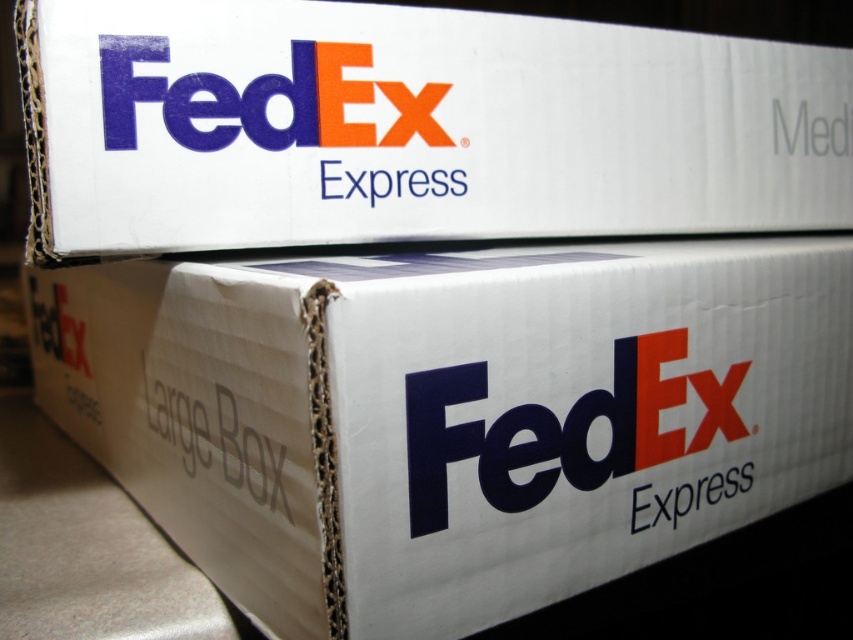
Is point (207, 460) more distant than point (473, 451)?

That is True.

Who is shorter, white cardboard box at center or matte cardboard fedex express logo at center?

matte cardboard fedex express logo at center

Identify the location of white cardboard box at center. (448, 413).

Between point (241, 122) and point (704, 504), which one is positioned behind?

The point (704, 504) is behind.

The width and height of the screenshot is (853, 640). I want to click on white cardboard box at upper center, so click(x=410, y=125).

Looking at this image, who is taller, white cardboard box at center or matte cardboard fedex logo at upper center?

white cardboard box at center is taller.

The image size is (853, 640). What are the coordinates of `white cardboard box at center` in the screenshot? It's located at (448, 413).